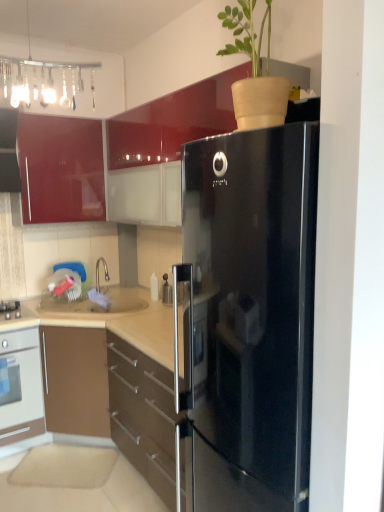
Question: Would you consider white glossy oven at lower left to be distant from glossy red cabinet at upper left, which is counted as the first cabinetry, starting from the top?

Choices:
 (A) no
 (B) yes

Answer: (B)

Question: Does white glossy oven at lower left come in front of glossy red cabinet at upper left, arranged as the second cabinetry when ordered from the bottom?

Choices:
 (A) no
 (B) yes

Answer: (B)

Question: Does white glossy oven at lower left lie behind glossy red cabinet at upper left, arranged as the second cabinetry when ordered from the bottom?

Choices:
 (A) yes
 (B) no

Answer: (B)

Question: From the image's perspective, is white glossy oven at lower left on top of glossy red cabinet at upper left, arranged as the second cabinetry when ordered from the bottom?

Choices:
 (A) no
 (B) yes

Answer: (A)

Question: Is glossy red cabinet at upper left, which is counted as the first cabinetry, starting from the top, a part of white glossy oven at lower left?

Choices:
 (A) yes
 (B) no

Answer: (B)

Question: From their relative heights in the image, would you say glossy red cabinet at upper left, which is counted as the first cabinetry, starting from the top, is taller or shorter than white glossy oven at lower left?

Choices:
 (A) short
 (B) tall

Answer: (A)

Question: Is glossy red cabinet at upper left, which is counted as the first cabinetry, starting from the top, inside the boundaries of white glossy oven at lower left, or outside?

Choices:
 (A) outside
 (B) inside

Answer: (A)

Question: Looking at their shapes, would you say glossy red cabinet at upper left, arranged as the second cabinetry when ordered from the bottom, is wider or thinner than white glossy oven at lower left?

Choices:
 (A) wide
 (B) thin

Answer: (B)

Question: Visually, is glossy red cabinet at upper left, which is counted as the first cabinetry, starting from the top, positioned to the left or to the right of white glossy oven at lower left?

Choices:
 (A) left
 (B) right

Answer: (B)

Question: Is white glossy oven at lower left taller or shorter than brown glossy cabinet at lower left, the first cabinetry positioned from the bottom?

Choices:
 (A) tall
 (B) short

Answer: (A)

Question: Looking at the image, does white glossy oven at lower left seem bigger or smaller compared to brown glossy cabinet at lower left, the first cabinetry positioned from the bottom?

Choices:
 (A) small
 (B) big

Answer: (A)

Question: Based on their positions, is white glossy oven at lower left located to the left or right of brown glossy cabinet at lower left, arranged as the second cabinetry when viewed from the top?

Choices:
 (A) left
 (B) right

Answer: (A)

Question: From a real-world perspective, is white glossy oven at lower left physically located above or below brown glossy cabinet at lower left, arranged as the second cabinetry when viewed from the top?

Choices:
 (A) above
 (B) below

Answer: (A)

Question: Which is correct: brown glossy cabinet at lower left, the first cabinetry positioned from the bottom, is inside glossy red cabinet at upper left, arranged as the second cabinetry when ordered from the bottom, or outside of it?

Choices:
 (A) outside
 (B) inside

Answer: (A)

Question: In the image, is brown glossy cabinet at lower left, arranged as the second cabinetry when viewed from the top, on the left side or the right side of glossy red cabinet at upper left, which is counted as the first cabinetry, starting from the top?

Choices:
 (A) left
 (B) right

Answer: (B)